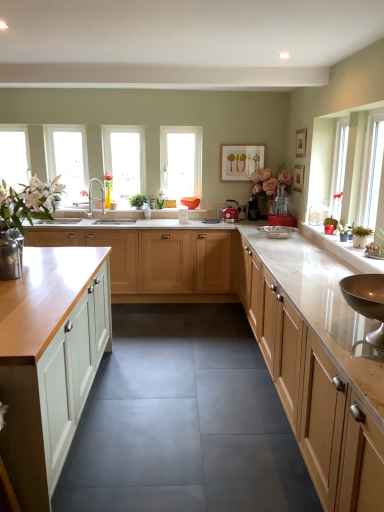
Where is `free space in front of matte red kettle at center, which is the third appliance from right to left`? This screenshot has width=384, height=512. free space in front of matte red kettle at center, which is the third appliance from right to left is located at coordinates (229, 225).